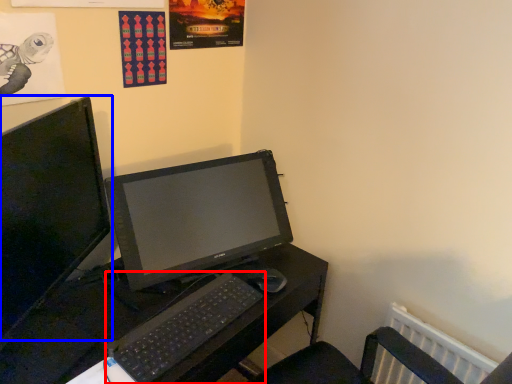
Question: Which of the following is the closest to the observer, computer keyboard (highlighted by a red box) or computer monitor (highlighted by a blue box)?

Choices:
 (A) computer keyboard
 (B) computer monitor

Answer: (B)